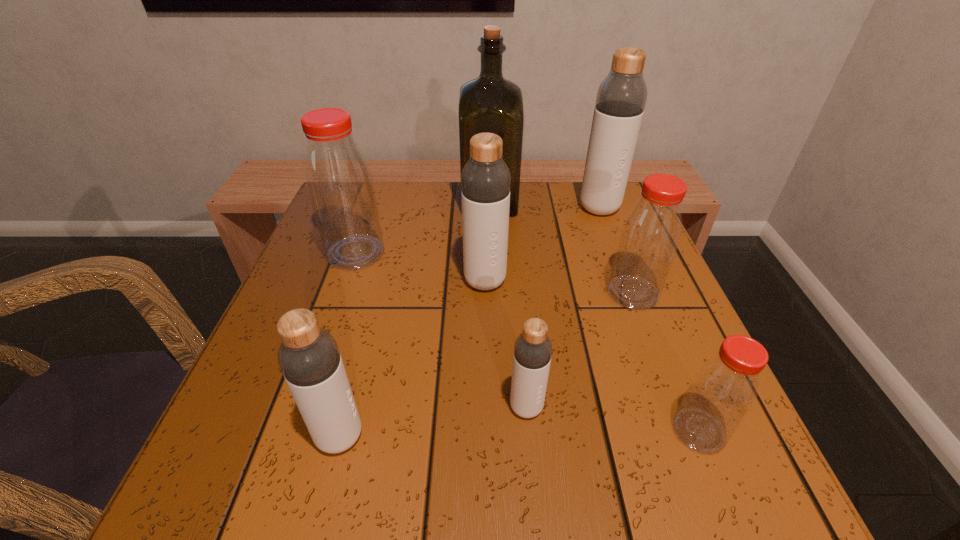
The image size is (960, 540). Find the location of `bottle object that ranks as the second closest to the third smallest gray bottle`. bottle object that ranks as the second closest to the third smallest gray bottle is located at coordinates (650, 235).

Locate an element on the screen. The image size is (960, 540). the third closest bottle to the leftmost red bottle is located at coordinates (532, 354).

Select which gray bottle appears as the closest to the leftmost gray bottle. Please provide its 2D coordinates. Your answer should be formatted as a tuple, i.e. [(x, y)], where the tuple contains the x and y coordinates of a point satisfying the conditions above.

[(532, 354)]

You are a GUI agent. You are given a task and a screenshot of the screen. Output one action in this format:
    pyautogui.click(x=<x>, y=<y>)
    Task: Click on the gray bottle that is the third closest to the farthest bottle
    
    Given the screenshot: What is the action you would take?
    tap(309, 358)

Identify the location of red bottle that is the third closest to the liquor. The width and height of the screenshot is (960, 540). [724, 388].

You are a GUI agent. You are given a task and a screenshot of the screen. Output one action in this format:
    pyautogui.click(x=<x>, y=<y>)
    Task: Click on the second closest red bottle to the nearest red bottle
    
    Given the screenshot: What is the action you would take?
    pyautogui.click(x=340, y=186)

You are a GUI agent. You are given a task and a screenshot of the screen. Output one action in this format:
    pyautogui.click(x=<x>, y=<y>)
    Task: Click on the vacant space that satisfies the following two spatial constraints: 1. on the back side of the biggest gray bottle; 2. on the label of the liquor
    
    Given the screenshot: What is the action you would take?
    pyautogui.click(x=596, y=201)

Where is `free point that satisfies the following two spatial constraints: 1. on the back side of the second smallest gray bottle; 2. on the right side of the nearest red bottle`? Image resolution: width=960 pixels, height=540 pixels. free point that satisfies the following two spatial constraints: 1. on the back side of the second smallest gray bottle; 2. on the right side of the nearest red bottle is located at coordinates (342, 431).

This screenshot has height=540, width=960. In order to click on vacant space that satisfies the following two spatial constraints: 1. on the label of the rightmost gray bottle; 2. on the left side of the liquor in this screenshot , I will do `click(490, 208)`.

Image resolution: width=960 pixels, height=540 pixels. Identify the location of vacant space that satisfies the following two spatial constraints: 1. on the label of the liquor; 2. on the back side of the smallest gray bottle. (495, 407).